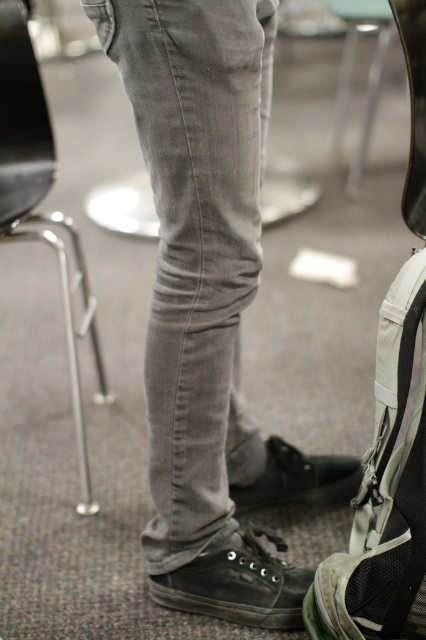
You are a photographer setting up a shoot in a classroom. You want to ensure that both the denim pants at center and the dark brown canvas shoe at lower center are clearly visible in the photo. Based on their positions, which object should you focus on first to ensure both are in focus?

The denim pants at center is in front of the dark brown canvas shoe at lower center, so you should focus on the denim pants at center first to ensure both are in focus.

You are standing next to the metallic silver chair at left and want to place your backpack on the floor. The backpack is 2 feet wide. Is there enough space between you and the chair to place it without moving?

The distance between you and the metallic silver chair at left is 4.84 feet, which is more than enough space to place a 2 feet wide backpack without needing to move.